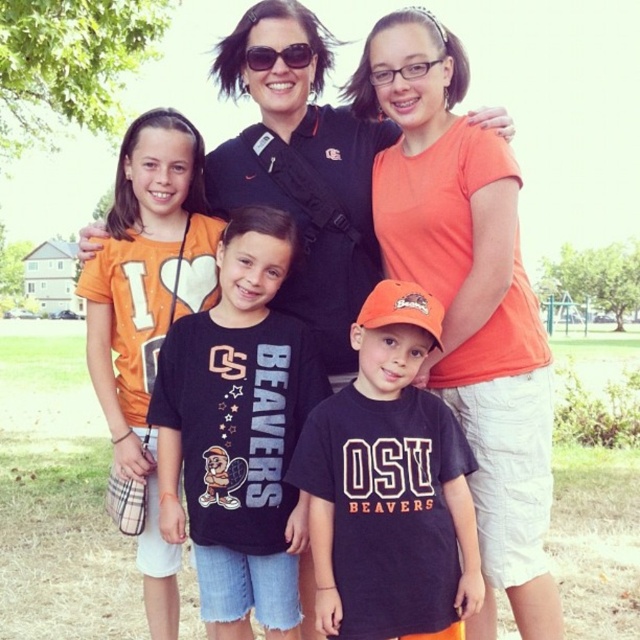
Can you confirm if orange cotton shirt at upper right is taller than dark blue cotton shirt at center?

No.

Can you confirm if orange cotton shirt at upper right is wider than dark blue cotton shirt at center?

No.

What do you see at coordinates (467, 298) in the screenshot? This screenshot has width=640, height=640. I see `orange cotton shirt at upper right` at bounding box center [467, 298].

Identify the location of orange cotton shirt at upper right. The height and width of the screenshot is (640, 640). (467, 298).

Who is taller, orange cotton shirt at upper right or black plastic sunglasses at upper center?

Standing taller between the two is orange cotton shirt at upper right.

Image resolution: width=640 pixels, height=640 pixels. What do you see at coordinates (467, 298) in the screenshot?
I see `orange cotton shirt at upper right` at bounding box center [467, 298].

At what (x,y) coordinates should I click in order to perform the action: click on orange cotton shirt at upper right. Please return your answer as a coordinate pair (x, y). This screenshot has height=640, width=640. Looking at the image, I should click on (467, 298).

From the picture: How distant is dark blue cotton shirt at center from orange cotton shirt at left?

A distance of 6.66 feet exists between dark blue cotton shirt at center and orange cotton shirt at left.

Between dark blue cotton shirt at center and orange cotton shirt at left, which one appears on the right side from the viewer's perspective?

dark blue cotton shirt at center

Describe the element at coordinates (388, 486) in the screenshot. I see `dark blue cotton shirt at center` at that location.

This screenshot has width=640, height=640. What are the coordinates of `dark blue cotton shirt at center` in the screenshot? It's located at (388, 486).